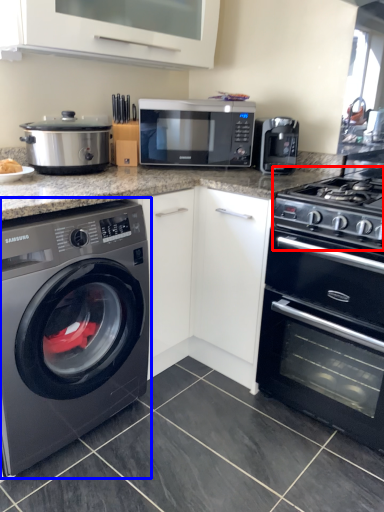
Question: Which object is further to the camera taking this photo, gas stove (highlighted by a red box) or washing machine (highlighted by a blue box)?

Choices:
 (A) gas stove
 (B) washing machine

Answer: (A)